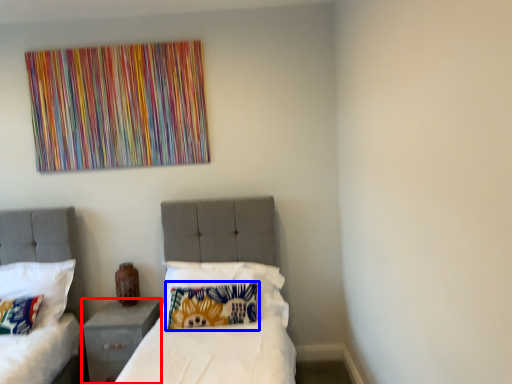
Question: Among these objects, which one is farthest to the camera, nightstand (highlighted by a red box) or pillow (highlighted by a blue box)?

Choices:
 (A) nightstand
 (B) pillow

Answer: (A)